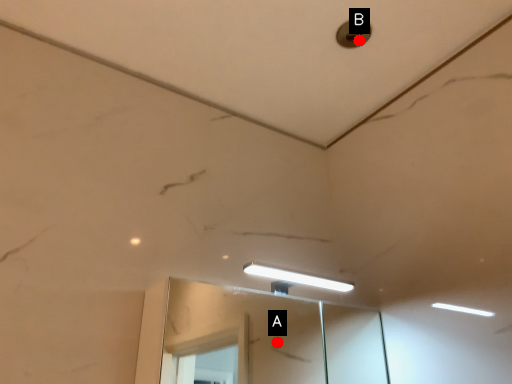
Question: Two points are circled on the image, labeled by A and B beside each circle. Which of the following is the farthest from the observer?

Choices:
 (A) A is further
 (B) B is further

Answer: (A)